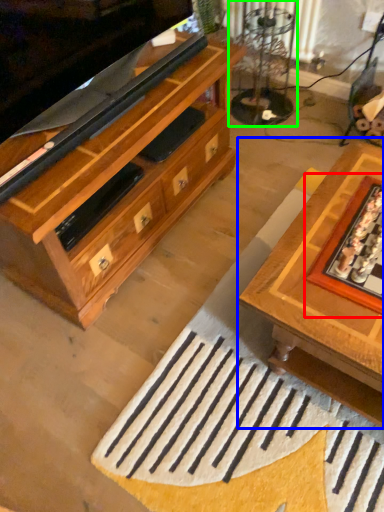
Question: Which object is positioned closest to board game (highlighted by a red box)? Select from table (highlighted by a blue box) and glass table (highlighted by a green box).

Choices:
 (A) table
 (B) glass table

Answer: (A)